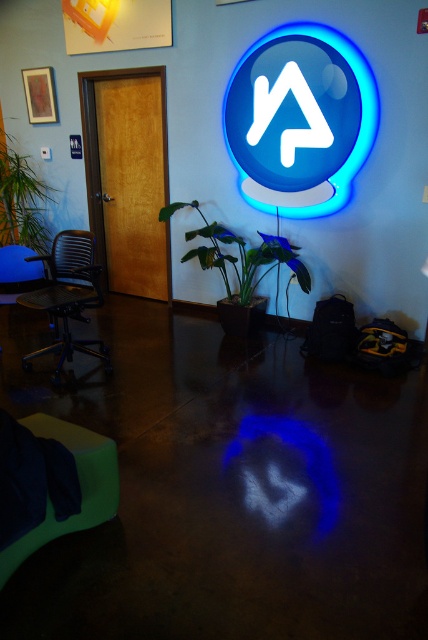
Is blue glass neon sign at upper center to the right of green fabric swivel chair at lower left from the viewer's perspective?

Correct, you'll find blue glass neon sign at upper center to the right of green fabric swivel chair at lower left.

This screenshot has width=428, height=640. In order to click on blue glass neon sign at upper center in this screenshot , I will do [x=300, y=120].

Which of these two, green glossy plant at center or green leafy plant at left, stands taller?

With more height is green leafy plant at left.

Who is more distant from viewer, [190,257] or [8,205]?

The point [8,205] is more distant.

Is point (196, 228) less distant than point (5, 152)?

Yes, it is in front of point (5, 152).

The height and width of the screenshot is (640, 428). I want to click on green glossy plant at center, so click(238, 259).

The image size is (428, 640). Find the location of `green fabric swivel chair at lower left`. green fabric swivel chair at lower left is located at coordinates coord(80,486).

Can you confirm if green fabric swivel chair at lower left is positioned to the right of green glossy plant at center?

In fact, green fabric swivel chair at lower left is to the left of green glossy plant at center.

Is point (97, 438) positioned in front of point (181, 202)?

Yes, point (97, 438) is in front of point (181, 202).

The width and height of the screenshot is (428, 640). I want to click on green fabric swivel chair at lower left, so click(x=80, y=486).